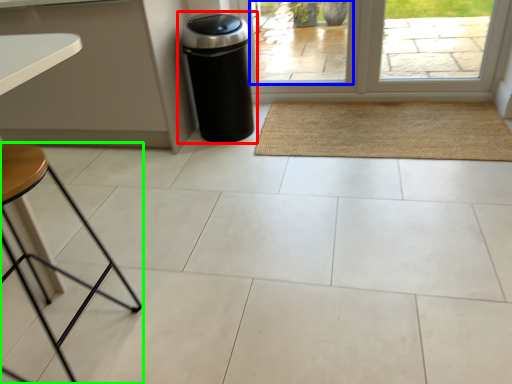
Question: Which is nearer to the waste container (highlighted by a red box)? window (highlighted by a blue box) or furniture (highlighted by a green box).

Choices:
 (A) window
 (B) furniture

Answer: (A)